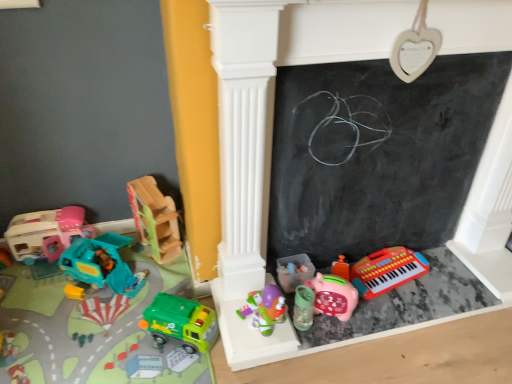
Question: Choose the correct answer: Is teal plastic truck at left, which appears as the second toy when viewed from the left, inside matte plastic playhouse at left, which is the first toy from left to right, or outside it?

Choices:
 (A) outside
 (B) inside

Answer: (A)

Question: From their relative heights in the image, would you say teal plastic truck at left, which appears as the second toy when viewed from the left, is taller or shorter than matte plastic playhouse at left, which is the first toy from left to right?

Choices:
 (A) short
 (B) tall

Answer: (A)

Question: Estimate the real-world distances between objects in this image. Which object is closer to the matte plastic playhouse at left, positioned as the seventh toy in right-to-left order?

Choices:
 (A) teal plastic truck at left, which appears as the second toy when viewed from the left
 (B) green plastic toy truck at lower left, the fourth toy positioned from the left
 (C) pink matte piggy bank at lower center, which is the 6th toy in left-to-right order
 (D) black chalkboard at center
 (E) translucent plastic toy at center, the third toy when ordered from right to left

Answer: (A)

Question: Which object is the farthest from the translucent plastic toy at center, the 5th toy positioned from the left?

Choices:
 (A) matte plastic playhouse at left, which is the first toy from left to right
 (B) green plastic toy truck at lower left, the fourth toy positioned from the left
 (C) rubberized plastic keyboard at lower right, which is the 7th toy in left-to-right order
 (D) teal plastic truck at left, the 6th toy in the right-to-left sequence
 (E) wooden truck at left, acting as the 3th toy starting from the left

Answer: (A)